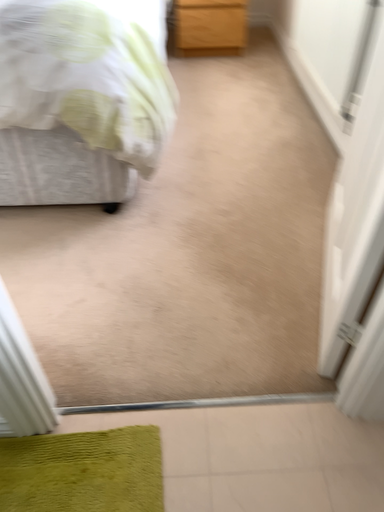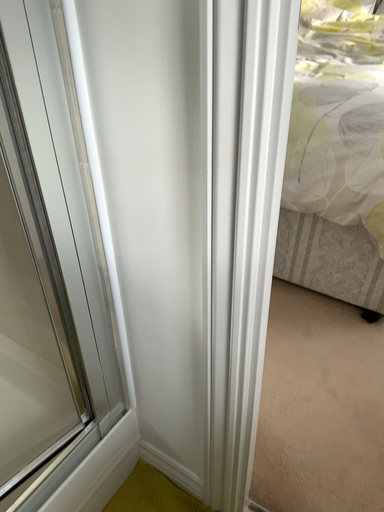
Question: Which way did the camera rotate in the video?

Choices:
 (A) rotated right
 (B) rotated left

Answer: (B)